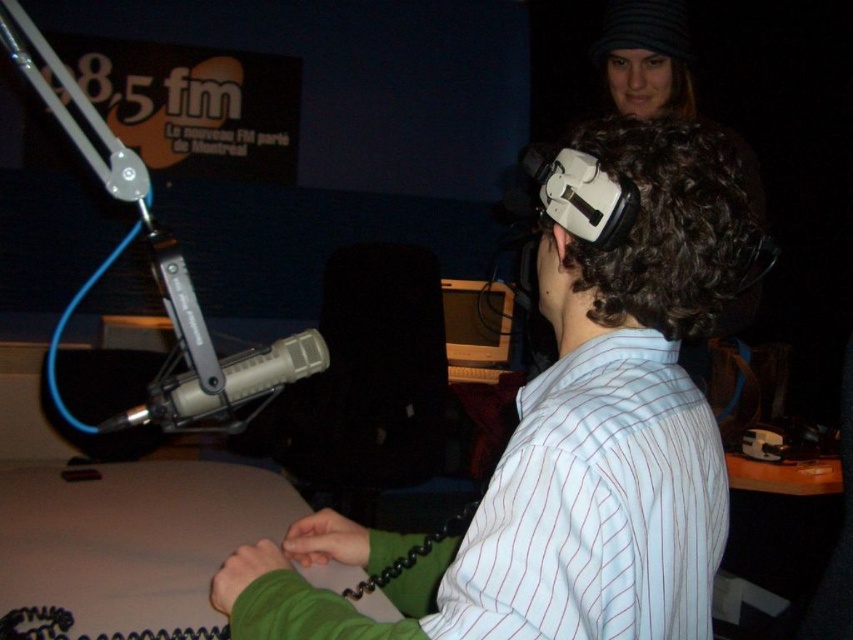
Question: Which object is positioned closest to the wooden desktop computer at center?

Choices:
 (A) white matte vr headset at center
 (B) matte gray microphone at left

Answer: (B)

Question: Does white matte vr headset at center have a lesser width compared to matte gray microphone at left?

Choices:
 (A) yes
 (B) no

Answer: (B)

Question: Considering the real-world distances, which object is closest to the white matte vr headset at center?

Choices:
 (A) wooden desktop computer at center
 (B) matte gray microphone at left

Answer: (B)

Question: Which point is farther to the camera?

Choices:
 (A) (318, 356)
 (B) (555, 256)
 (C) (482, 292)

Answer: (C)

Question: Is white matte vr headset at center further to the viewer compared to matte gray microphone at left?

Choices:
 (A) no
 (B) yes

Answer: (A)

Question: Observing the image, what is the correct spatial positioning of white matte vr headset at center in reference to wooden desktop computer at center?

Choices:
 (A) left
 (B) right

Answer: (A)